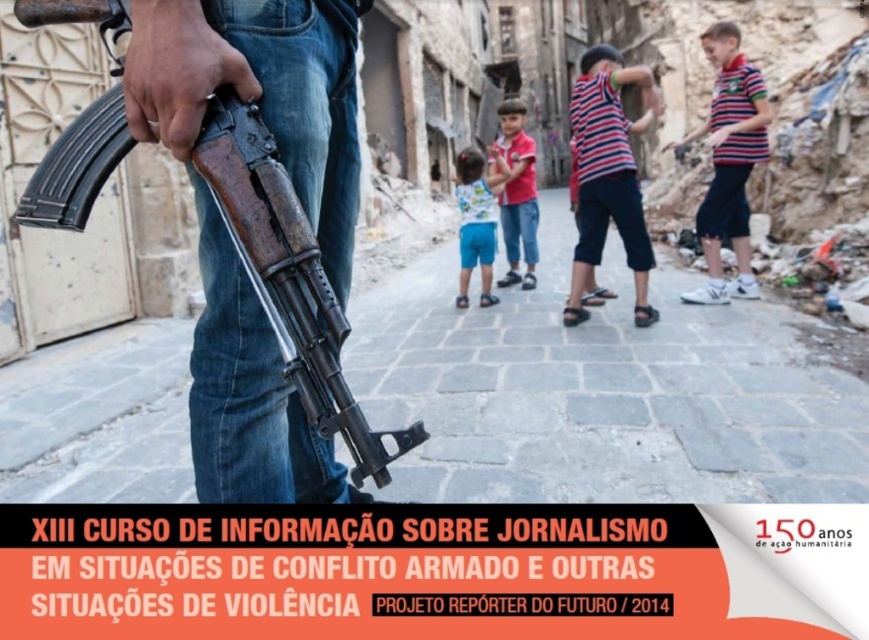
Question: Among these points, which one is farthest from the camera?

Choices:
 (A) (733, 150)
 (B) (264, 218)
 (C) (618, 196)
 (D) (503, 166)

Answer: (D)

Question: Can you confirm if matte red shirt at center is positioned above blue cotton shorts at center?

Choices:
 (A) no
 (B) yes

Answer: (B)

Question: Which object appears closest to the camera in this image?

Choices:
 (A) wooden rifle at left
 (B) blue cotton shorts at center

Answer: (A)

Question: Observing the image, what is the correct spatial positioning of matte red shirt at center in reference to blue cotton shorts at center?

Choices:
 (A) right
 (B) left

Answer: (A)

Question: Does striped cotton shirt at right have a greater width compared to matte red shirt at center?

Choices:
 (A) no
 (B) yes

Answer: (B)

Question: Based on their relative distances, which object is nearer to the striped cotton shirt at right?

Choices:
 (A) blue cotton shorts at center
 (B) matte red shirt at center

Answer: (A)